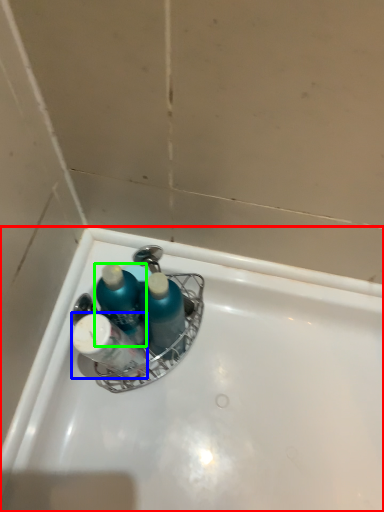
Question: Which is farther away from bathtub (highlighted by a red box)? toiletry (highlighted by a blue box) or mouthwash (highlighted by a green box)?

Choices:
 (A) toiletry
 (B) mouthwash

Answer: (B)